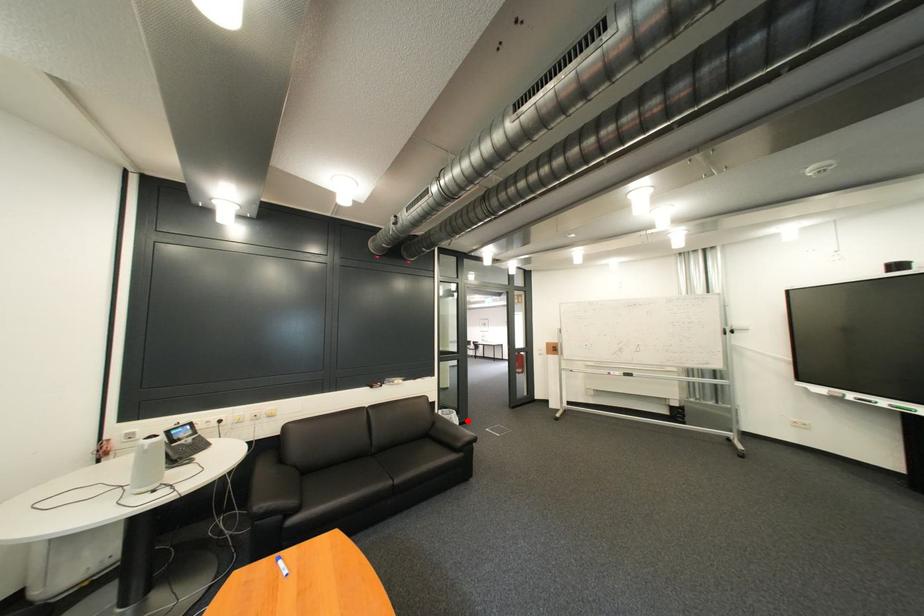
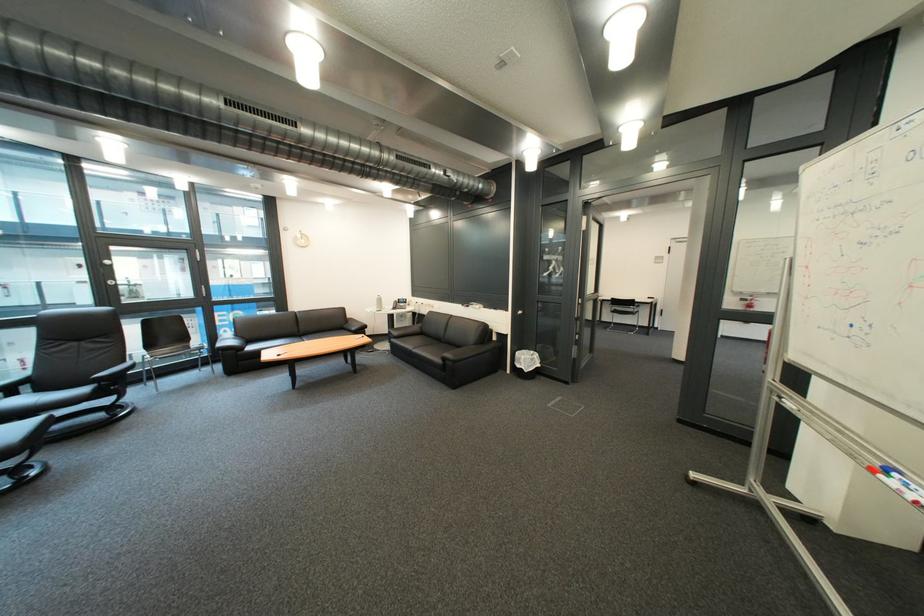
In the second image, find the point that corresponds to the highlighted location in the first image.

(536, 363)